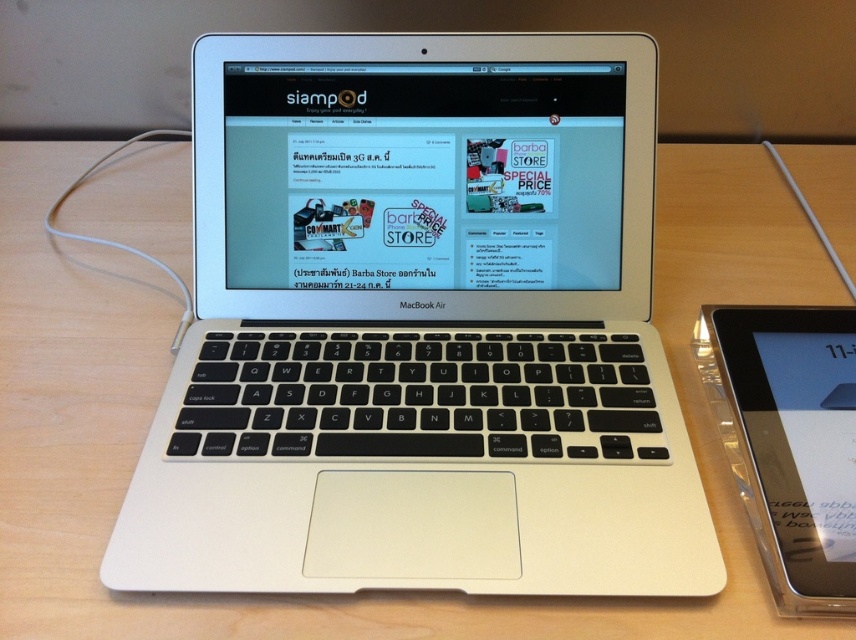
You are organizing your desk and need to place a new item between the silver metallic laptop at center and the clear plastic tablet at right. Where should you place it to ensure it fits between them?

The silver metallic laptop at center is located above the clear plastic tablet at right, so placing the new item between them would require positioning it below the silver metallic laptop at center and above the clear plastic tablet at right.

You are organizing your desk and need to place a new item between the silver metallic laptop at center and the clear plastic tablet at right. Where should you position it to ensure it is between them?

Place the new item between the silver metallic laptop at center and the clear plastic tablet at right, positioning it to the right of the silver metallic laptop at center and to the left of the clear plastic tablet at right since the laptop is to the left of the tablet.

You have a small toy car that is 10 inches long. You want to place it between the silver metallic laptop at center and the clear plastic tablet at right. Will the toy car fit horizontally between them without overlapping either device?

The silver metallic laptop at center is 8.55 inches from clear plastic tablet at right. Since the toy car is 10 inches long, which is longer than the 8.55 inches space between them, the toy car will not fit horizontally between the two devices without overlapping.